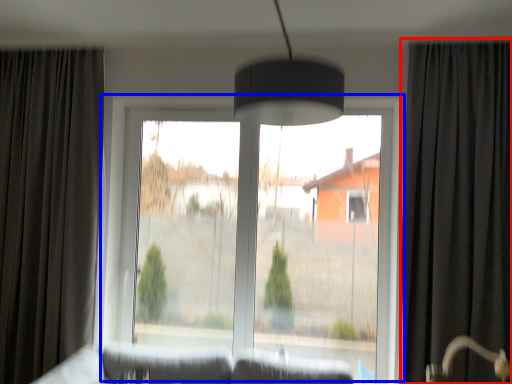
Question: Which of the following is the closest to the observer, curtain (highlighted by a red box) or window (highlighted by a blue box)?

Choices:
 (A) curtain
 (B) window

Answer: (A)